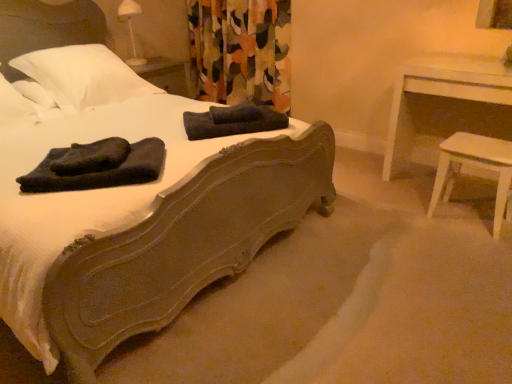
Question: Is white wood table at right thinner than floral fabric curtain at center?

Choices:
 (A) no
 (B) yes

Answer: (A)

Question: Is white wood table at right positioned with its back to floral fabric curtain at center?

Choices:
 (A) yes
 (B) no

Answer: (B)

Question: From the image's perspective, would you say white wood table at right is positioned over floral fabric curtain at center?

Choices:
 (A) no
 (B) yes

Answer: (A)

Question: Is white wood table at right smaller than floral fabric curtain at center?

Choices:
 (A) yes
 (B) no

Answer: (A)

Question: Does white wood table at right have a greater width compared to floral fabric curtain at center?

Choices:
 (A) yes
 (B) no

Answer: (A)

Question: From a real-world perspective, is white wood table at right over floral fabric curtain at center?

Choices:
 (A) no
 (B) yes

Answer: (A)

Question: From the image's perspective, would you say white soft pillow at upper left, arranged as the second pillow when viewed from the right, is shown under white wood stool at right?

Choices:
 (A) yes
 (B) no

Answer: (B)

Question: Does white soft pillow at upper left, marked as the 1th pillow in a left-to-right arrangement, have a smaller size compared to white wood stool at right?

Choices:
 (A) yes
 (B) no

Answer: (A)

Question: Considering the relative sizes of white soft pillow at upper left, marked as the 1th pillow in a left-to-right arrangement, and white wood stool at right in the image provided, is white soft pillow at upper left, marked as the 1th pillow in a left-to-right arrangement, shorter than white wood stool at right?

Choices:
 (A) yes
 (B) no

Answer: (A)

Question: Considering the relative positions of white soft pillow at upper left, arranged as the second pillow when viewed from the right, and white wood stool at right in the image provided, is white soft pillow at upper left, arranged as the second pillow when viewed from the right, in front of white wood stool at right?

Choices:
 (A) no
 (B) yes

Answer: (A)

Question: Can you confirm if white soft pillow at upper left, arranged as the second pillow when viewed from the right, is bigger than white wood stool at right?

Choices:
 (A) no
 (B) yes

Answer: (A)

Question: From a real-world perspective, is white soft pillow at upper left, arranged as the second pillow when viewed from the right, physically above white wood stool at right?

Choices:
 (A) yes
 (B) no

Answer: (A)

Question: Does dark blue fleece bath towel at center, the 3th bath towel viewed from the back, have a greater height compared to white soft pillow at upper left, which ranks as the second pillow in left-to-right order?

Choices:
 (A) yes
 (B) no

Answer: (B)